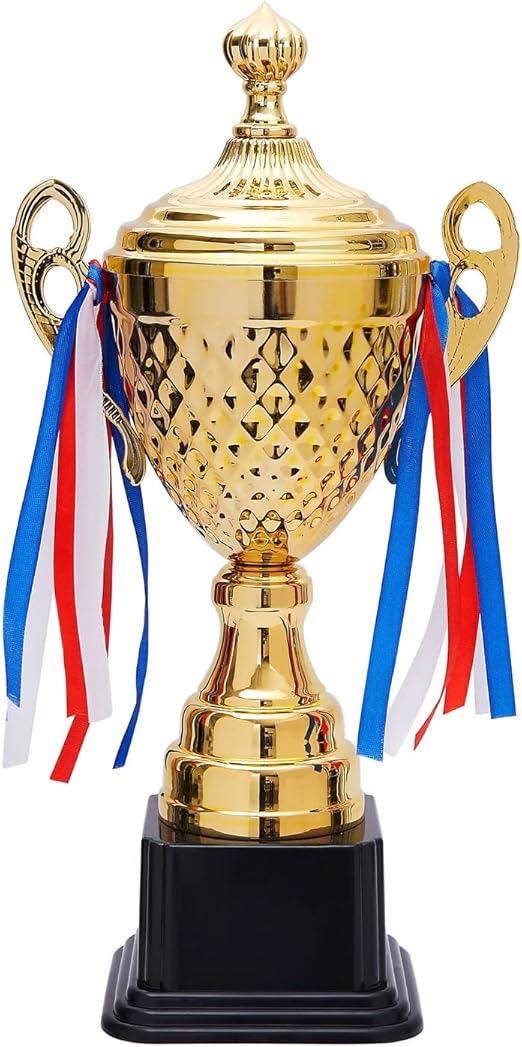
Identify the location of black trophy base. (268, 878).